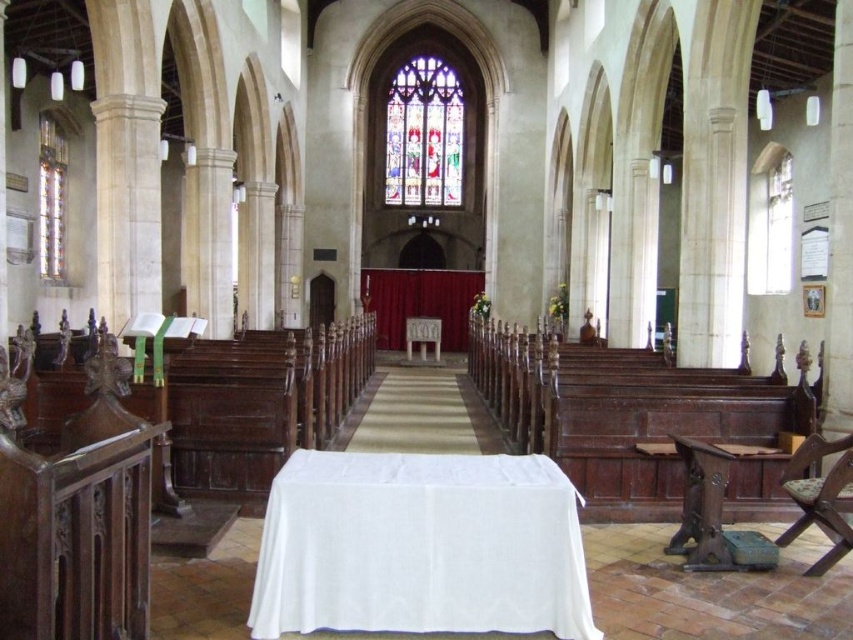
Is stained glass window at center shorter than wooden chair at right?

Incorrect, stained glass window at center's height does not fall short of wooden chair at right's.

Between stained glass window at center and wooden chair at right, which one has more height?

stained glass window at center

Between point (395, 134) and point (833, 538), which one is positioned behind?

The point (395, 134) is behind.

Find the location of a particular element. This screenshot has width=853, height=640. stained glass window at center is located at coordinates (424, 134).

Does dark brown wooden chair at lower right have a greater height compared to clear glass stained glass window at left?

No, dark brown wooden chair at lower right is not taller than clear glass stained glass window at left.

Image resolution: width=853 pixels, height=640 pixels. Find the location of `dark brown wooden chair at lower right`. dark brown wooden chair at lower right is located at coordinates (701, 506).

Between stained glass window at center and dark brown wooden chair at lower right, which one has less height?

dark brown wooden chair at lower right

Between stained glass window at center and dark brown wooden chair at lower right, which one appears on the left side from the viewer's perspective?

From the viewer's perspective, stained glass window at center appears more on the left side.

Describe the element at coordinates (424, 134) in the screenshot. The image size is (853, 640). I see `stained glass window at center` at that location.

Locate an element on the screen. The width and height of the screenshot is (853, 640). stained glass window at center is located at coordinates pyautogui.click(x=424, y=134).